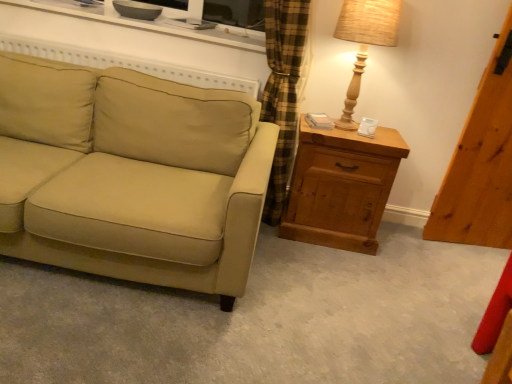
Image resolution: width=512 pixels, height=384 pixels. In order to click on vacant space in front of wooden chest of drawers at right in this screenshot , I will do `click(317, 267)`.